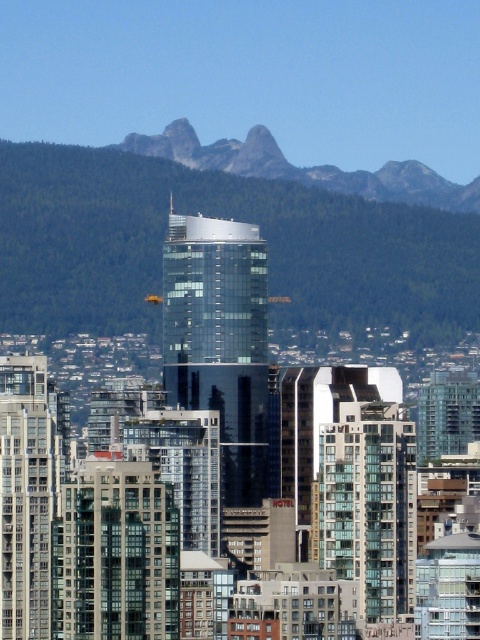
You are an architect designing a new building in this urban area. You want to ensure that the building has a view of both the green forested mountain at upper center and the gray rocky mountain at upper center. Based on their positions, which mountain should you place the building closer to in order to frame both views?

You should place the building closer to the green forested mountain at upper center because it is positioned on the left side of the gray rocky mountain at upper center, allowing the building to be situated between them for a balanced view of both mountains.

What does the point at coordinates (x=219, y=216) represent in the image?

The point at coordinates (x=219, y=216) marks a green forested mountain at upper center.

You are standing at a viewpoint overlooking the city. You notice a specific point marked at coordinates point (16,166). Given that the safe viewing distance for this point is 500 meters, is the current distance you are at safe?

The distance of point (16,166) from camera is 660.10 meters, which exceeds the safe viewing distance of 500 meters. Therefore, the current distance is safe.